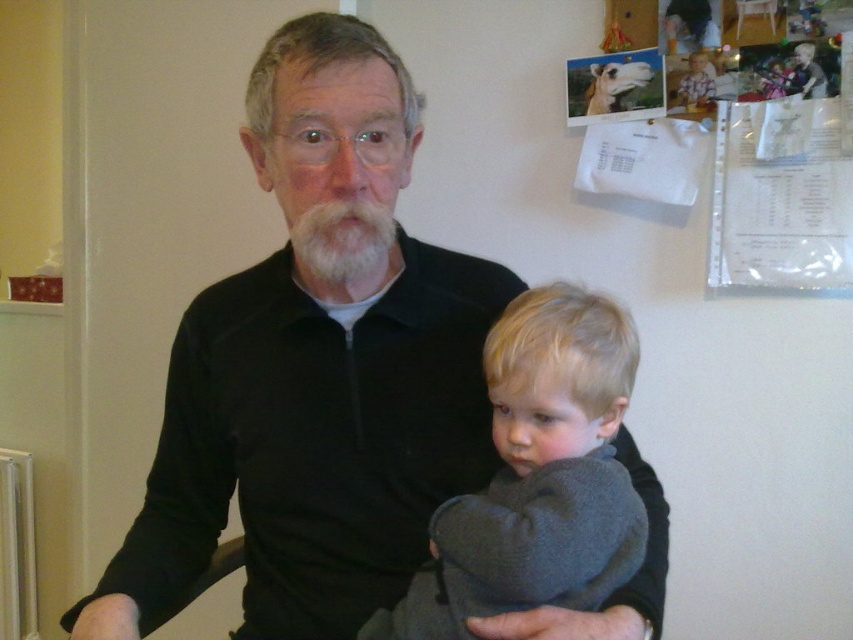
Is black zip-up sweater at center to the right of gray fleece jacket at center from the viewer's perspective?

Incorrect, black zip-up sweater at center is not on the right side of gray fleece jacket at center.

This screenshot has width=853, height=640. Find the location of `black zip-up sweater at center`. black zip-up sweater at center is located at coordinates (311, 440).

This screenshot has height=640, width=853. Describe the element at coordinates (311, 440) in the screenshot. I see `black zip-up sweater at center` at that location.

Find the location of a particular element. black zip-up sweater at center is located at coordinates (311, 440).

Which is more to the left, black smooth arm at center or white fuzzy beard at center?

black smooth arm at center

Is black smooth arm at center to the left of white fuzzy beard at center from the viewer's perspective?

Yes, black smooth arm at center is to the left of white fuzzy beard at center.

Between point (164, 481) and point (343, 216), which one is positioned behind?

Point (164, 481)

Locate an element on the screen. black smooth arm at center is located at coordinates (171, 497).

Does gray fleece jacket at center have a lesser height compared to black smooth arm at center?

Correct, gray fleece jacket at center is not as tall as black smooth arm at center.

This screenshot has width=853, height=640. Identify the location of gray fleece jacket at center. (537, 476).